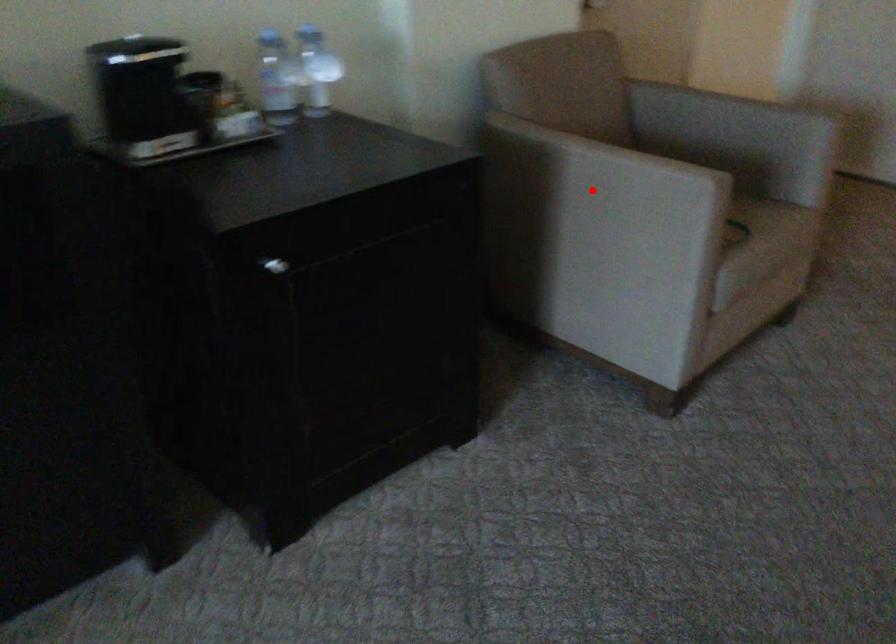
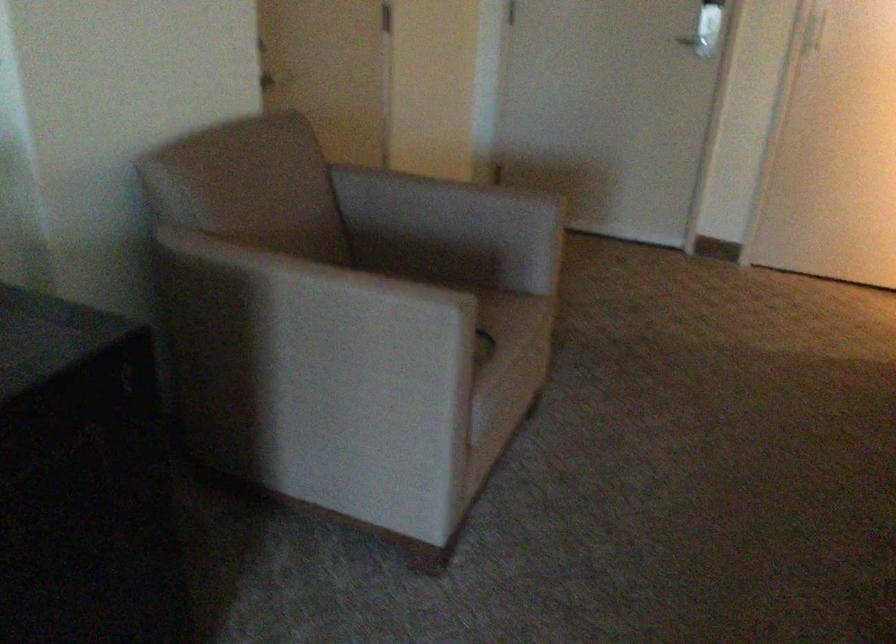
Question: A red point is marked in image1. In image2, is the corresponding 3D point closer to the camera or farther? Reply with the corresponding letter.

Choices:
 (A) The corresponding 3D point is closer.
 (B) The corresponding 3D point is farther.

Answer: (A)